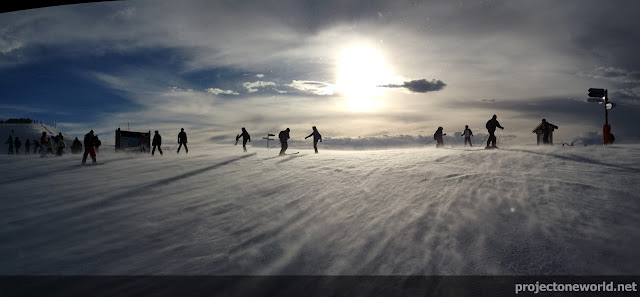
The image size is (640, 297). In order to click on floor in this screenshot , I will do `click(324, 222)`.